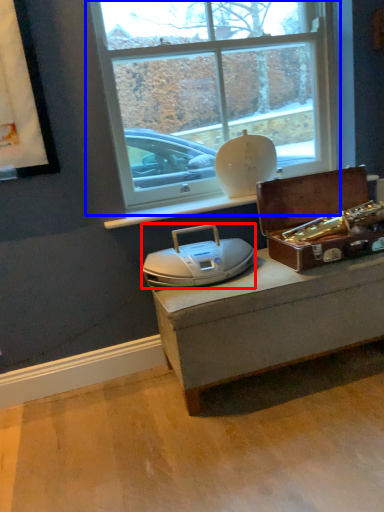
Question: Which of the following is the closest to the observer, stereo (highlighted by a red box) or window (highlighted by a blue box)?

Choices:
 (A) stereo
 (B) window

Answer: (A)